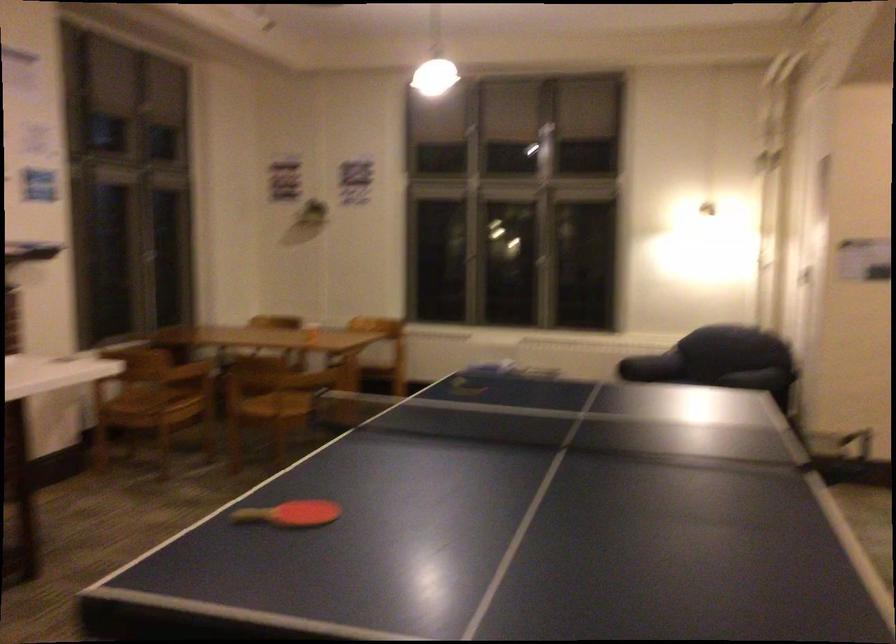
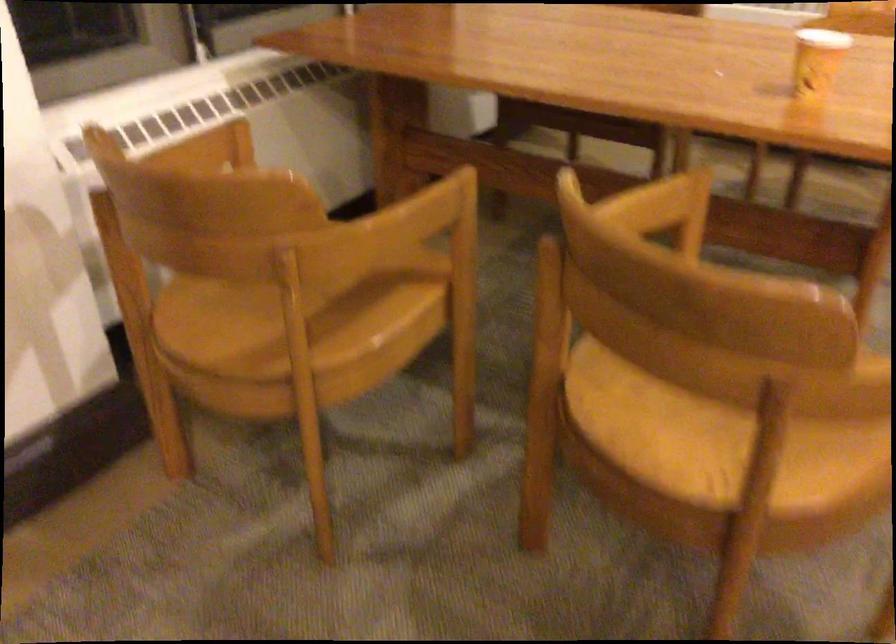
Where in the second image is the point corresponding to pixel 311 330 from the first image?

(816, 61)